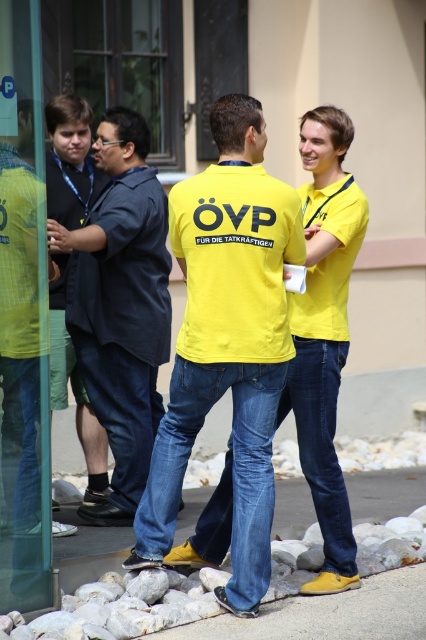
Question: Is transparent glass door at left below smooth concrete pavement at lower center?

Choices:
 (A) no
 (B) yes

Answer: (A)

Question: Which of these objects is positioned closest to the dark blue shirt at left?

Choices:
 (A) transparent glass door at left
 (B) yellow matte shirt at center
 (C) matte black jacket at left
 (D) smooth concrete pavement at lower center

Answer: (C)

Question: In this image, where is yellow matte shirt at center located relative to matte black jacket at left?

Choices:
 (A) below
 (B) above

Answer: (B)

Question: Does smooth concrete pavement at lower center lie behind matte black jacket at left?

Choices:
 (A) yes
 (B) no

Answer: (B)

Question: Which point appears closest to the camera in this image?

Choices:
 (A) (17, 74)
 (B) (399, 474)
 (C) (69, 202)
 (D) (94, 280)

Answer: (A)

Question: Which point appears closest to the camera in this image?

Choices:
 (A) (190, 403)
 (B) (92, 177)
 (C) (127, 173)

Answer: (A)